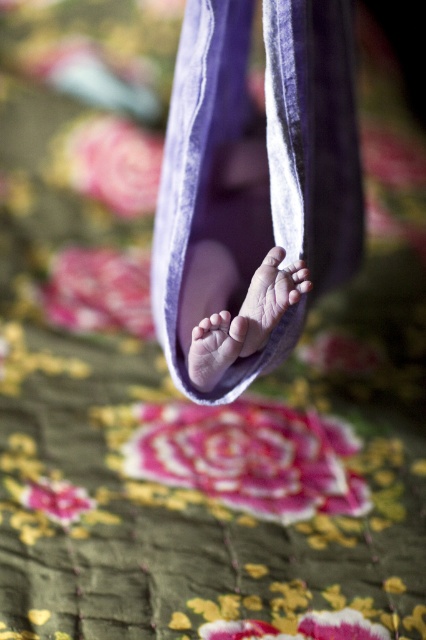
Locate an element on the screen. The width and height of the screenshot is (426, 640). smooth skin foot at center is located at coordinates (249, 320).

Which is below, smooth skin foot at center or matte pink foot at center?

smooth skin foot at center is lower down.

Identify the location of smooth skin foot at center. This screenshot has height=640, width=426. (249, 320).

Describe the element at coordinates (249, 320) in the screenshot. I see `smooth skin foot at center` at that location.

Who is positioned more to the left, smooth skin foot at center or pink velvet foot at center?

Positioned to the left is smooth skin foot at center.

Is point (298, 276) positioned before point (233, 344)?

Yes.

This screenshot has height=640, width=426. I want to click on smooth skin foot at center, so click(x=249, y=320).

Who is lower down, purple velvet wrap at center or smooth skin foot at center?

smooth skin foot at center is lower down.

Is purple velvet wrap at center to the left of smooth skin foot at center from the viewer's perspective?

In fact, purple velvet wrap at center is to the right of smooth skin foot at center.

The width and height of the screenshot is (426, 640). What are the coordinates of `purple velvet wrap at center` in the screenshot? It's located at (253, 188).